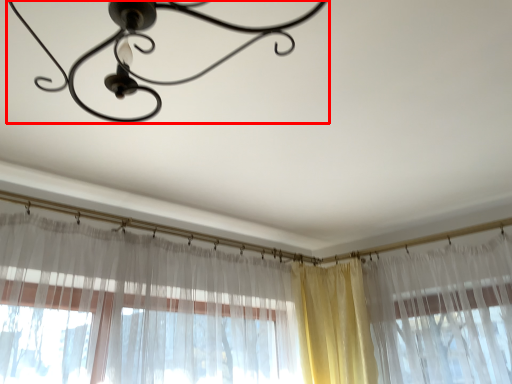
Question: From the image's perspective, where is lamp (annotated by the red box) located relative to curtain?

Choices:
 (A) below
 (B) above

Answer: (B)